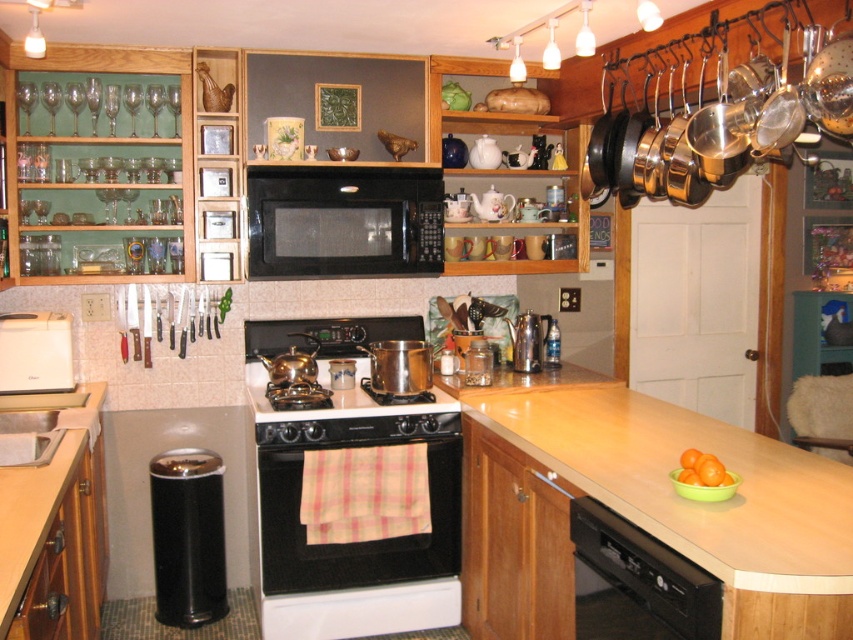
You are standing in the kitchen and want to reach both the bread machine and the trash can. The bread machine is located at point (252,172) and the trash can is at point (412,413). Which object will you encounter first as you move towards them?

You will encounter the trash can at point (412,413) first because point (252,172) is behind point (412,413).

You are organizing the kitchen and need to place a new spice jar between the wooden at lower left and the white plastic toaster at lower left. Based on their current positions, which object should the spice jar be closer to?

The spice jar should be placed closer to the white plastic toaster at lower left because the wooden at lower left is positioned to the right of the white plastic toaster at lower left.

You are a chef preparing dinner and need to access both the black matte microwave at center and the metallic silver stove at center. Which appliance will you need to reach over to use first?

The black matte microwave at center is positioned over the metallic silver stove at center, so you would need to access the metallic silver stove at center first before reaching the black matte microwave at center.